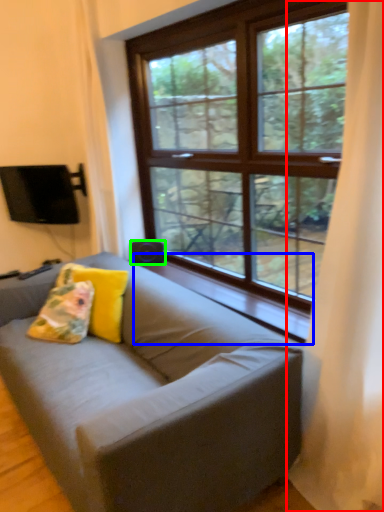
Question: Estimate the real-world distances between objects in this image. Which object is closer to curtain (highlighted by a red box), window sill (highlighted by a blue box) or speaker (highlighted by a green box)?

Choices:
 (A) window sill
 (B) speaker

Answer: (A)